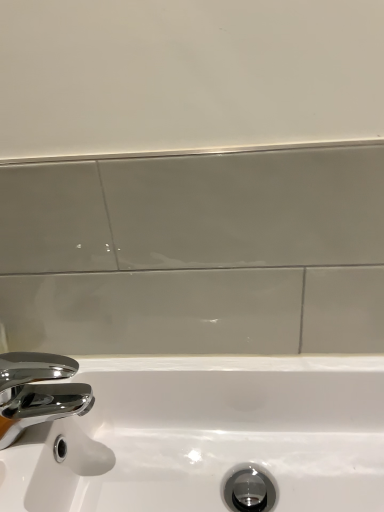
Question: Looking at the image, does chrome/metallic faucet at lower left seem bigger or smaller compared to white glossy sink at lower left?

Choices:
 (A) big
 (B) small

Answer: (B)

Question: From the image's perspective, is chrome/metallic faucet at lower left located above or below white glossy sink at lower left?

Choices:
 (A) above
 (B) below

Answer: (A)

Question: Considering the positions of point (11, 441) and point (153, 501), is point (11, 441) closer or farther from the camera than point (153, 501)?

Choices:
 (A) closer
 (B) farther

Answer: (A)

Question: From the image's perspective, is white glossy sink at lower left positioned above or below chrome/metallic faucet at lower left?

Choices:
 (A) above
 (B) below

Answer: (B)

Question: In terms of size, does white glossy sink at lower left appear bigger or smaller than chrome/metallic faucet at lower left?

Choices:
 (A) big
 (B) small

Answer: (A)

Question: From a real-world perspective, is white glossy sink at lower left physically located above or below chrome/metallic faucet at lower left?

Choices:
 (A) below
 (B) above

Answer: (A)

Question: Is white glossy sink at lower left inside the boundaries of chrome/metallic faucet at lower left, or outside?

Choices:
 (A) inside
 (B) outside

Answer: (B)